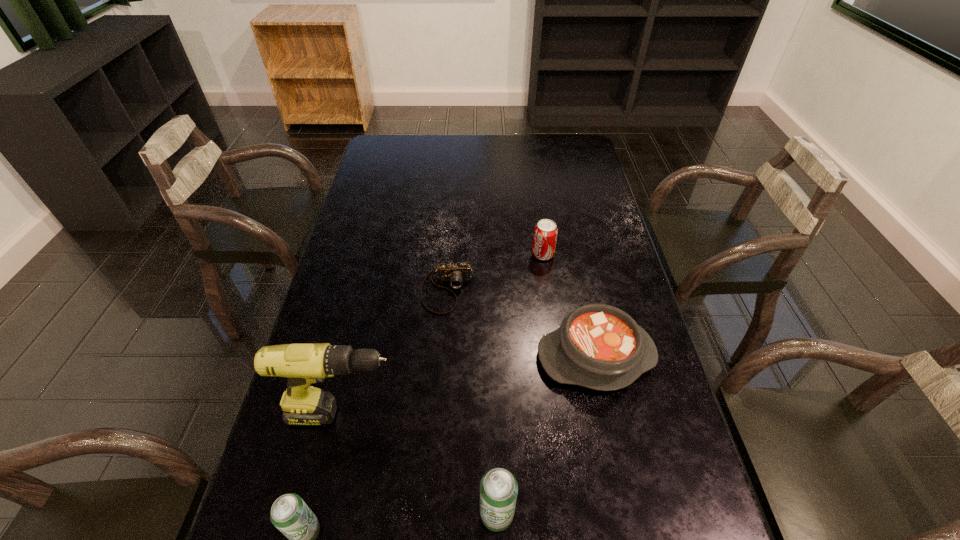
Select which object appears as the third closest to the left beer can. Please provide its 2D coordinates. Your answer should be formatted as a tuple, i.e. [(x, y)], where the tuple contains the x and y coordinates of a point satisfying the conditions above.

[(598, 346)]

Locate which object is the third closest to the left beer can. Please provide its 2D coordinates. Your answer should be formatted as a tuple, i.e. [(x, y)], where the tuple contains the x and y coordinates of a point satisfying the conditions above.

[(598, 346)]

This screenshot has height=540, width=960. I want to click on free space that satisfies the following two spatial constraints: 1. on the front side of the soda; 2. on the left side of the casserole, so click(558, 356).

At what (x,y) coordinates should I click in order to perform the action: click on free space that satisfies the following two spatial constraints: 1. on the handle side of the right beer can; 2. on the right side of the tallest object. Please return your answer as a coordinate pair (x, y). This screenshot has width=960, height=540. Looking at the image, I should click on (322, 515).

Where is `free spot that satisfies the following two spatial constraints: 1. on the front side of the second shortest object; 2. on the handle side of the tallest object`? This screenshot has height=540, width=960. free spot that satisfies the following two spatial constraints: 1. on the front side of the second shortest object; 2. on the handle side of the tallest object is located at coordinates (609, 414).

Identify the location of vacant area in the image that satisfies the following two spatial constraints: 1. on the handle side of the tallest object; 2. on the back side of the right beer can. (322, 515).

The width and height of the screenshot is (960, 540). What are the coordinates of `free space that satisfies the following two spatial constraints: 1. on the handle side of the drill; 2. on the back side of the fourth object from left to right` in the screenshot? It's located at (322, 515).